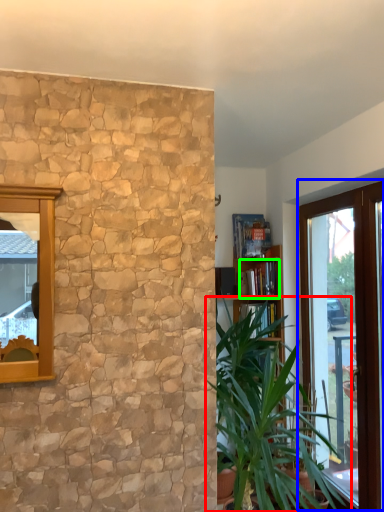
Question: Which object is the closest to the houseplant (highlighted by a red box)? Choose among these: window (highlighted by a blue box) or book (highlighted by a green box).

Choices:
 (A) window
 (B) book

Answer: (A)